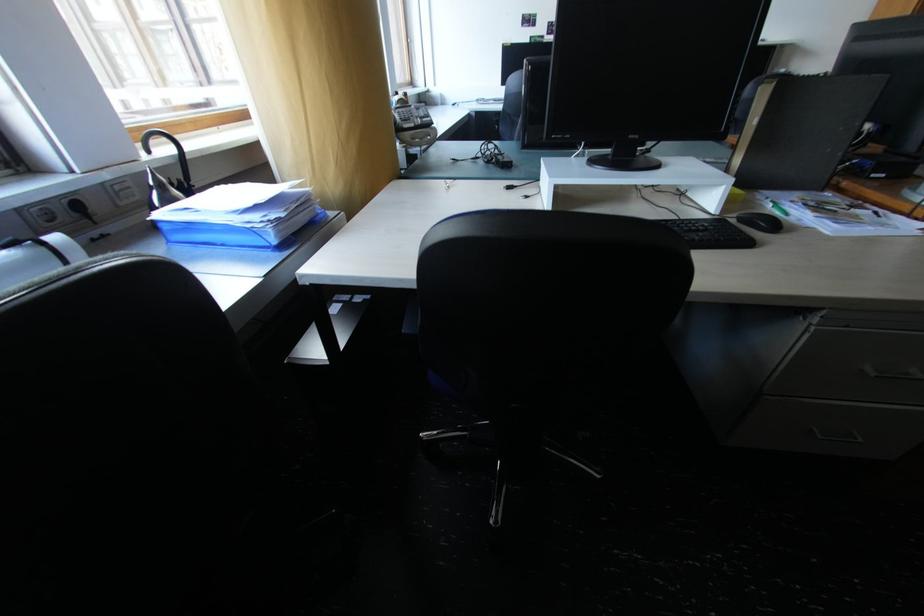
Describe the element at coordinates (410, 116) in the screenshot. I see `the telephone handset` at that location.